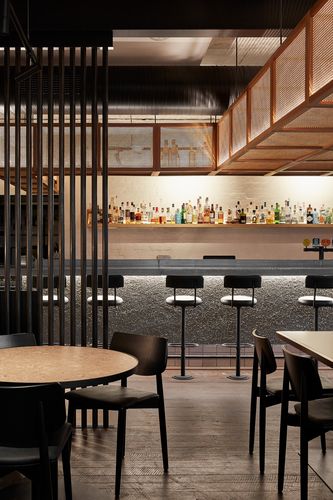
Locate an element on the screen. This screenshot has width=333, height=500. rectangular table is located at coordinates (326, 342).